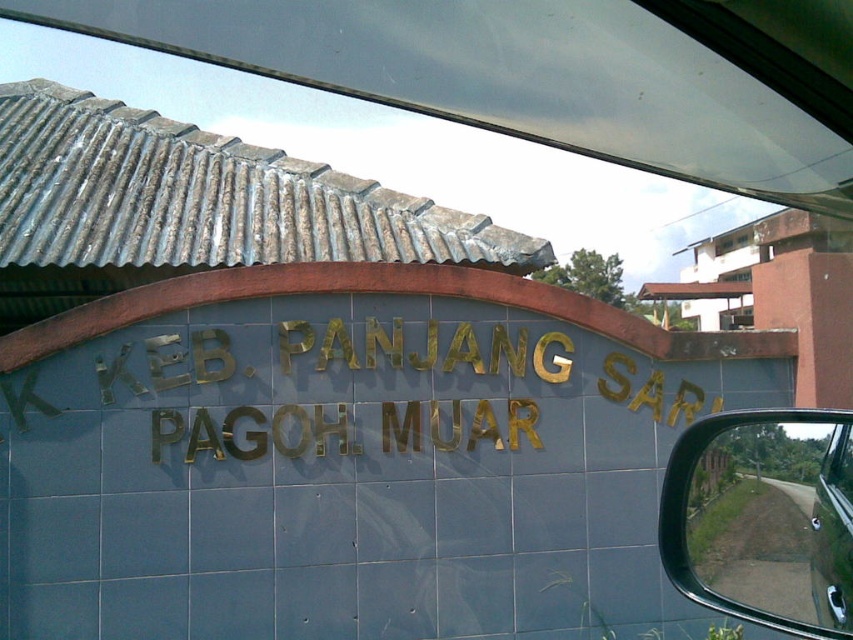
Based on the photo, is gold metallic sign at center thinner than glossy metallic side mirror at lower right?

In fact, gold metallic sign at center might be wider than glossy metallic side mirror at lower right.

Is gold metallic sign at center bigger than glossy metallic side mirror at lower right?

Yes.

Is point (627, 406) positioned in front of point (845, 474)?

No, it is not.

The image size is (853, 640). In order to click on gold metallic sign at center in this screenshot , I will do `click(427, 349)`.